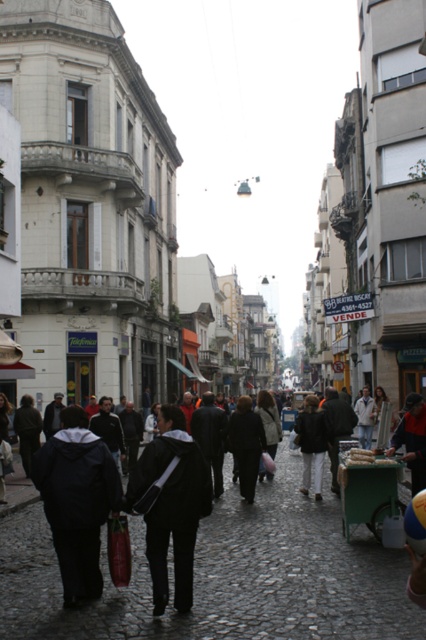
You are a delivery person trying to reach the black fabric bag at center. There is a black fabric crowd at center blocking the way. Can you walk straight ahead to reach the bag?

The black fabric crowd at center is in front of the black fabric bag at center, so walking straight ahead would lead you to the crowd first, blocking your path to the bag.

You are a tourist in this European city and you see both the black fabric crowd at center and the black fabric bag at center. Which one is located to the left when facing the scene?

The black fabric crowd at center is located to the left of the black fabric bag at center.

You are a delivery person carrying a package that is 1.5 feet wide. You need to move from the black fabric crowd at center to the black fabric bag at center. Can your package fit through the space between them?

The distance between the black fabric crowd at center and the black fabric bag at center is 15.15 feet, which is significantly wider than the 1.5 feet width of your package. Therefore, your package can easily fit through the space between them.